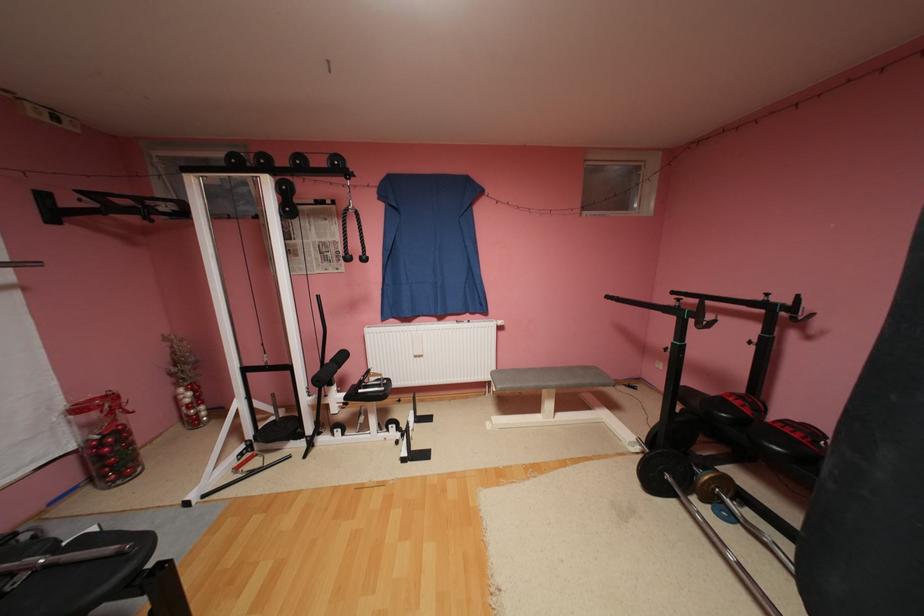
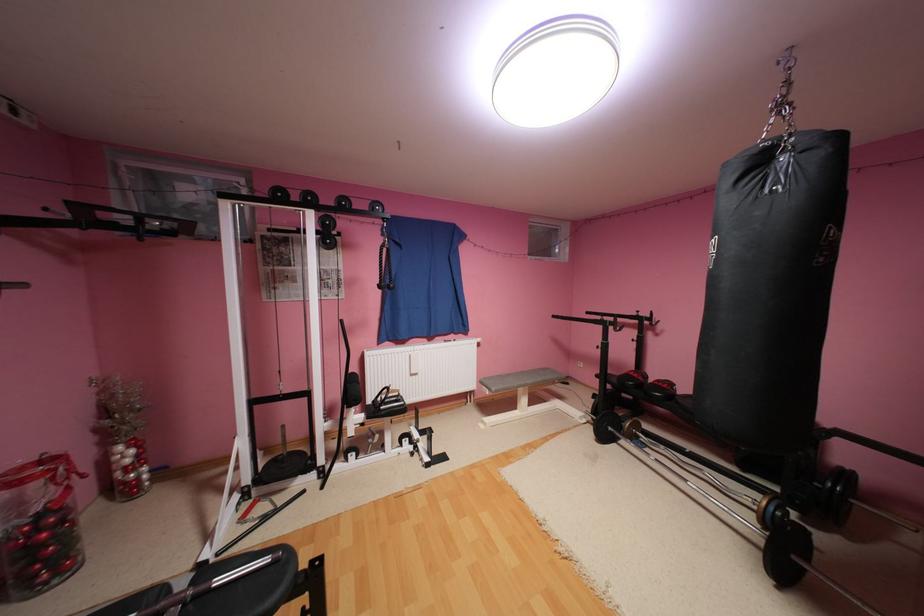
Question: The camera is either moving clockwise (left) or counter-clockwise (right) around the object. The first image is from the beginning of the video and the second image is from the end. Is the camera moving left or right when shooting the video?

Choices:
 (A) Left
 (B) Right

Answer: (A)